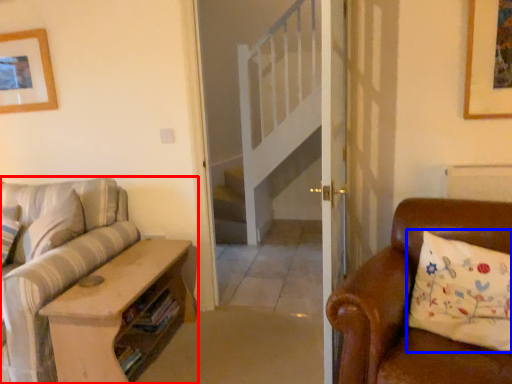
Question: Which object is closer to the camera taking this photo, studio couch (highlighted by a red box) or pillow (highlighted by a blue box)?

Choices:
 (A) studio couch
 (B) pillow

Answer: (B)